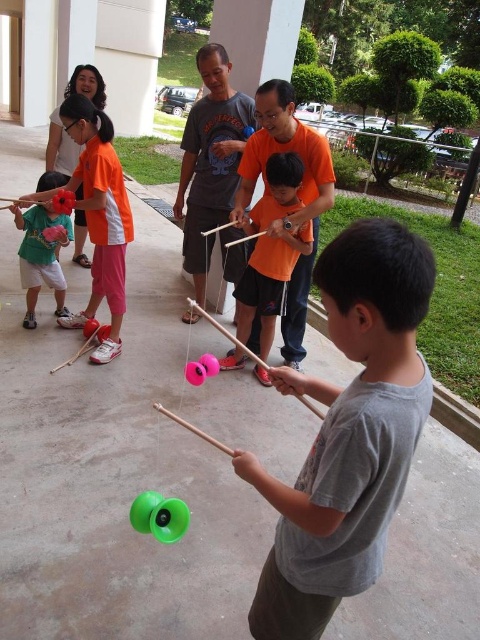
You are a photographer trying to capture a clear shot of the gray matte shirt at center and the matte pink toy at center. Since you want to focus on the taller object, which one should you adjust your camera settings for?

The matte pink toy at center is taller than the gray matte shirt at center, so you should adjust your camera settings to focus on the matte pink toy at center.